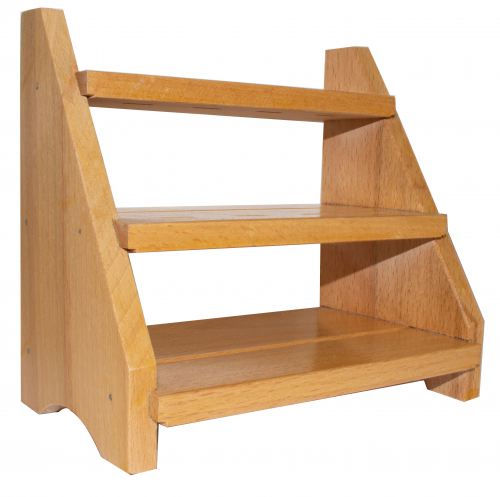
Locate an element on the screen. The height and width of the screenshot is (497, 500). first stair step is located at coordinates (375, 345).